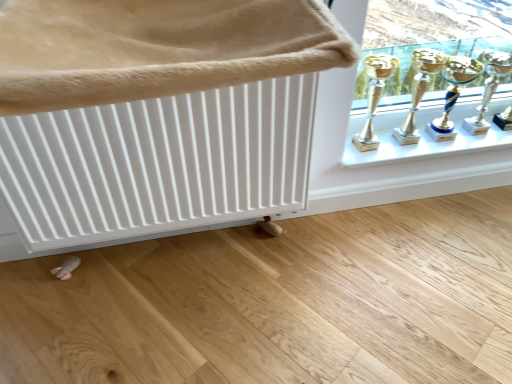
The image size is (512, 384). What do you see at coordinates (453, 94) in the screenshot?
I see `gold metallic trophy at upper right, which is the 1th candle holder from left to right` at bounding box center [453, 94].

The image size is (512, 384). What do you see at coordinates (419, 90) in the screenshot?
I see `gold metallic trophy at upper right, which is the first trophy in right-to-left order` at bounding box center [419, 90].

Describe the element at coordinates (158, 163) in the screenshot. Image resolution: width=512 pixels, height=384 pixels. I see `white matte radiator at upper left` at that location.

What do you see at coordinates (420, 138) in the screenshot?
I see `white glossy window sill at upper right` at bounding box center [420, 138].

The width and height of the screenshot is (512, 384). I want to click on gold metallic trophy at upper right, which ranks as the second candle holder in right-to-left order, so click(453, 94).

How many degrees apart are the facing directions of gold metallic trophy at upper right, which is the first trophy in right-to-left order, and gold metallic trophy at upper right, marked as the second trophy in a right-to-left arrangement?

1.25 degrees.

Is gold metallic trophy at upper right, marked as the second trophy in a right-to-left arrangement, a part of gold metallic trophy at upper right, which is the first trophy in right-to-left order?

No, gold metallic trophy at upper right, which is the first trophy in right-to-left order, does not contain gold metallic trophy at upper right, marked as the second trophy in a right-to-left arrangement.

Considering the relative sizes of gold metallic trophy at upper right, which is the first trophy in right-to-left order, and gold metallic trophy at upper right, marked as the second trophy in a right-to-left arrangement, in the image provided, is gold metallic trophy at upper right, which is the first trophy in right-to-left order, smaller than gold metallic trophy at upper right, marked as the second trophy in a right-to-left arrangement,?

Incorrect, gold metallic trophy at upper right, which is the first trophy in right-to-left order, is not smaller in size than gold metallic trophy at upper right, marked as the second trophy in a right-to-left arrangement.

From their relative heights in the image, would you say gold metallic trophy at upper right, marked as the 1th trophy in a left-to-right arrangement, is taller or shorter than white matte radiator at upper left?

gold metallic trophy at upper right, marked as the 1th trophy in a left-to-right arrangement, is shorter than white matte radiator at upper left.

Is white matte radiator at upper left located within gold metallic trophy at upper right, marked as the second trophy in a right-to-left arrangement?

No, white matte radiator at upper left is not surrounded by gold metallic trophy at upper right, marked as the second trophy in a right-to-left arrangement.

From the image's perspective, which object appears higher, gold metallic trophy at upper right, marked as the 1th trophy in a left-to-right arrangement, or white matte radiator at upper left?

From the image's view, gold metallic trophy at upper right, marked as the 1th trophy in a left-to-right arrangement, is above.

At what (x,y) coordinates should I click in order to perform the action: click on the 1st candle holder counting from the right side of the gold metallic trophy at upper right, acting as the second trophy starting from the left. Please return your answer as a coordinate pair (x, y). Looking at the image, I should click on (453, 94).

Is gold metallic trophy at upper right, which is the first trophy in right-to-left order, taller than gold metallic trophy at upper right, which is the 1th candle holder from left to right?

Correct, gold metallic trophy at upper right, which is the first trophy in right-to-left order, is much taller as gold metallic trophy at upper right, which is the 1th candle holder from left to right.

Considering the points (412, 142) and (438, 140), which point is behind, point (412, 142) or point (438, 140)?

The point (438, 140) is farther.

Considering the sizes of objects gold metallic trophy at upper right, which is the 1th candle holder from left to right, and white textured radiator at upper left in the image provided, who is smaller, gold metallic trophy at upper right, which is the 1th candle holder from left to right, or white textured radiator at upper left?

Smaller between the two is gold metallic trophy at upper right, which is the 1th candle holder from left to right.

From the image's perspective, which one is positioned lower, gold metallic trophy at upper right, which is the 1th candle holder from left to right, or white textured radiator at upper left?

From the image's view, gold metallic trophy at upper right, which is the 1th candle holder from left to right, is below.

Which object is further away from the camera, gold metallic trophy at upper right, which ranks as the second candle holder in right-to-left order, or white textured radiator at upper left?

gold metallic trophy at upper right, which ranks as the second candle holder in right-to-left order, is behind.

Is gold metallic trophy at upper right, marked as the 1th trophy in a left-to-right arrangement, taller or shorter than gold metallic trophy at upper right, which ranks as the second candle holder in right-to-left order?

Considering their sizes, gold metallic trophy at upper right, marked as the 1th trophy in a left-to-right arrangement, has more height than gold metallic trophy at upper right, which ranks as the second candle holder in right-to-left order.

How distant is gold metallic trophy at upper right, marked as the 1th trophy in a left-to-right arrangement, from gold metallic trophy at upper right, which ranks as the second candle holder in right-to-left order?

The distance of gold metallic trophy at upper right, marked as the 1th trophy in a left-to-right arrangement, from gold metallic trophy at upper right, which ranks as the second candle holder in right-to-left order, is 8.97 inches.

In the image, is gold metallic trophy at upper right, marked as the second trophy in a right-to-left arrangement, positioned in front of or behind gold metallic trophy at upper right, which is the 1th candle holder from left to right?

gold metallic trophy at upper right, marked as the second trophy in a right-to-left arrangement, is positioned closer to the viewer than gold metallic trophy at upper right, which is the 1th candle holder from left to right.

Can you see gold metallic trophy at upper right, marked as the 1th trophy in a left-to-right arrangement, touching gold metallic trophy at upper right, which ranks as the second candle holder in right-to-left order?

No, gold metallic trophy at upper right, marked as the 1th trophy in a left-to-right arrangement, is not with gold metallic trophy at upper right, which ranks as the second candle holder in right-to-left order.

From a real-world perspective, is white textured radiator at upper left located higher than gold metallic trophy at upper right, which is the first trophy in right-to-left order?

Yes, from a real-world perspective, white textured radiator at upper left is over gold metallic trophy at upper right, which is the first trophy in right-to-left order

From the image's perspective, which object appears higher, white textured radiator at upper left or gold metallic trophy at upper right, which is the first trophy in right-to-left order?

white textured radiator at upper left, from the image's perspective.

I want to click on trophy that is the 1st object located below the white textured radiator at upper left (from the image's perspective), so click(419, 90).

Does white textured radiator at upper left have a greater height compared to gold metallic trophy at upper right, which is the first trophy in right-to-left order?

In fact, white textured radiator at upper left may be shorter than gold metallic trophy at upper right, which is the first trophy in right-to-left order.

Is gold metallic trophy at upper right, which ranks as the second candle holder in right-to-left order, taller or shorter than white matte radiator at upper left?

In the image, gold metallic trophy at upper right, which ranks as the second candle holder in right-to-left order, appears to be shorter than white matte radiator at upper left.

Which of these two, gold metallic trophy at upper right, which ranks as the second candle holder in right-to-left order, or white matte radiator at upper left, is bigger?

white matte radiator at upper left.

Does point (426, 127) appear closer or farther from the camera than point (293, 137)?

Point (426, 127).

In the image, is gold metallic trophy at upper right, which is the 1th candle holder from left to right, positioned in front of or behind white matte radiator at upper left?

Clearly, gold metallic trophy at upper right, which is the 1th candle holder from left to right, is behind white matte radiator at upper left.

The height and width of the screenshot is (384, 512). Identify the location of trophy on the left of gold metallic trophy at upper right, acting as the second trophy starting from the left. (374, 96).

Starting from the white matte radiator at upper left, which trophy is the 1st one to the right? Please provide its 2D coordinates.

[(374, 96)]

Which object lies further to the anchor point white glossy window sill at upper right, gold metallic trophy at upper right, which ranks as the second candle holder in right-to-left order, or gold metallic trophy at upper right, acting as the second trophy starting from the left?

gold metallic trophy at upper right, acting as the second trophy starting from the left.

In the scene shown: Considering their positions, is white matte radiator at upper left positioned closer to white glossy window sill at upper right than gold metallic trophy at upper right, which is the 1th candle holder from left to right?

gold metallic trophy at upper right, which is the 1th candle holder from left to right, is closer to white glossy window sill at upper right.

Which object lies further to the anchor point white glossy window sill at upper right, white matte radiator at upper left or silver metallic trophy at upper right, the 1th candle holder when ordered from right to left?

white matte radiator at upper left is positioned further to the anchor white glossy window sill at upper right.

In the scene shown: From the image, which object appears to be farther from gold metallic trophy at upper right, which is the first trophy in right-to-left order, silver metallic trophy at upper right, acting as the 2th candle holder starting from the left, or white glossy window sill at upper right?

Among the two, silver metallic trophy at upper right, acting as the 2th candle holder starting from the left, is located further to gold metallic trophy at upper right, which is the first trophy in right-to-left order.

Based on their spatial positions, is gold metallic trophy at upper right, marked as the second trophy in a right-to-left arrangement, or gold metallic trophy at upper right, which is the first trophy in right-to-left order, closer to gold metallic trophy at upper right, which ranks as the second candle holder in right-to-left order?

The object closer to gold metallic trophy at upper right, which ranks as the second candle holder in right-to-left order, is gold metallic trophy at upper right, which is the first trophy in right-to-left order.

Which object lies nearer to the anchor point gold metallic trophy at upper right, which is the 1th candle holder from left to right, gold metallic trophy at upper right, marked as the second trophy in a right-to-left arrangement, or white textured radiator at upper left?

The object closer to gold metallic trophy at upper right, which is the 1th candle holder from left to right, is gold metallic trophy at upper right, marked as the second trophy in a right-to-left arrangement.

From the image, which object appears to be farther from gold metallic trophy at upper right, which ranks as the second candle holder in right-to-left order, silver metallic trophy at upper right, acting as the 2th candle holder starting from the left, or gold metallic trophy at upper right, marked as the 1th trophy in a left-to-right arrangement?

Based on the image, gold metallic trophy at upper right, marked as the 1th trophy in a left-to-right arrangement, appears to be further to gold metallic trophy at upper right, which ranks as the second candle holder in right-to-left order.

Looking at this image, looking at the image, which one is located closer to gold metallic trophy at upper right, marked as the second trophy in a right-to-left arrangement, gold metallic trophy at upper right, which is the first trophy in right-to-left order, or silver metallic trophy at upper right, the 1th candle holder when ordered from right to left?

gold metallic trophy at upper right, which is the first trophy in right-to-left order.

This screenshot has height=384, width=512. Identify the location of furniture located between white matte radiator at upper left and silver metallic trophy at upper right, the 1th candle holder when ordered from right to left, in the left-right direction. (157, 48).

Image resolution: width=512 pixels, height=384 pixels. In order to click on radiator located between white textured radiator at upper left and gold metallic trophy at upper right, marked as the second trophy in a right-to-left arrangement, in the depth direction in this screenshot , I will do `click(158, 163)`.

Where is `trophy located between gold metallic trophy at upper right, marked as the second trophy in a right-to-left arrangement, and white glossy window sill at upper right in the left-right direction`? trophy located between gold metallic trophy at upper right, marked as the second trophy in a right-to-left arrangement, and white glossy window sill at upper right in the left-right direction is located at coordinates (419, 90).

Identify the location of trophy located between gold metallic trophy at upper right, marked as the second trophy in a right-to-left arrangement, and silver metallic trophy at upper right, acting as the 2th candle holder starting from the left, in the left-right direction. (419, 90).